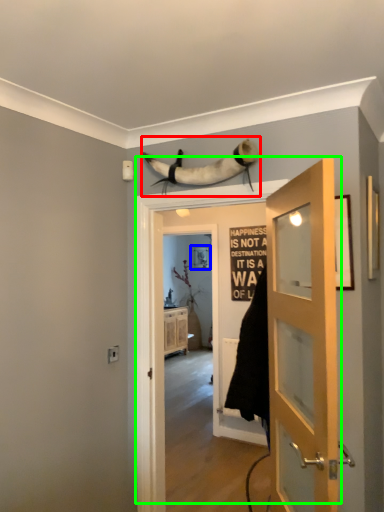
Question: Estimate the real-world distances between objects in this image. Which object is farther from animal (highlighted by a red box), picture frame (highlighted by a blue box) or door (highlighted by a green box)?

Choices:
 (A) picture frame
 (B) door

Answer: (A)